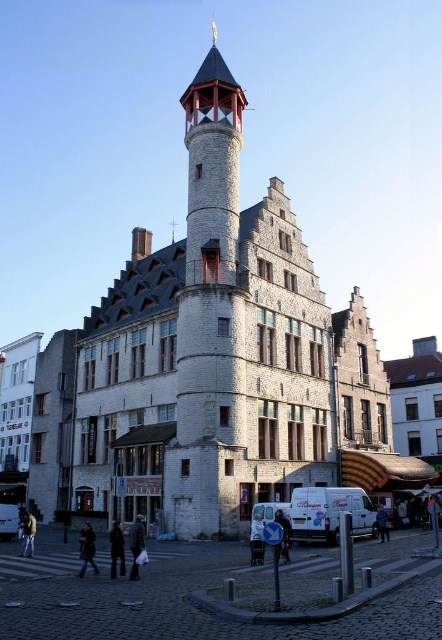
You are standing in the town square and want to take a photo of the light gray stone tower at center. If your camera has a maximum focus range of 150 feet, will you be able to capture the tower clearly?

The light gray stone tower at center is 172.21 feet away from the camera, which exceeds the maximum focus range of 150 feet. Therefore, you won1t be able to capture the tower clearly.

You are standing in the town square facing the historic building. The light gray stone tower at center is part of this building. If you want to take a photo that includes both the tower and the shops on the ground floor, where should you position yourself relative to the tower?

Since the light gray stone tower at center is located at point coordinates, you should position yourself to the left or right side of the tower to capture both the tower and the shops on the ground floor in your photo.

You are a delivery person carrying a large box that is 2 meters wide. You need to navigate through the space between the black leather jacket at lower center and the dark brown leather coat at lower left. Can you fit through this space without tilting the box?

The black leather jacket at lower center and dark brown leather coat at lower left are 3.56 meters apart. Since the box is 2 meters wide, there is enough space to pass through without tilting the box.